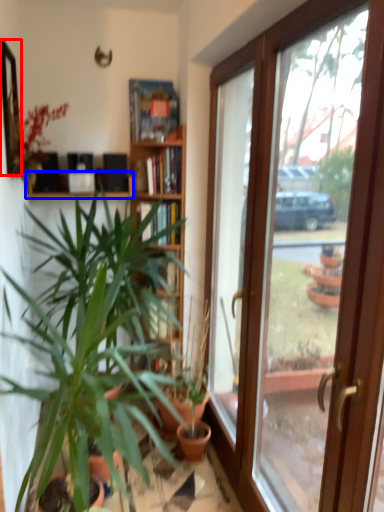
Question: Which object appears farthest to the camera in this image, mirror (highlighted by a red box) or shelf (highlighted by a blue box)?

Choices:
 (A) mirror
 (B) shelf

Answer: (B)